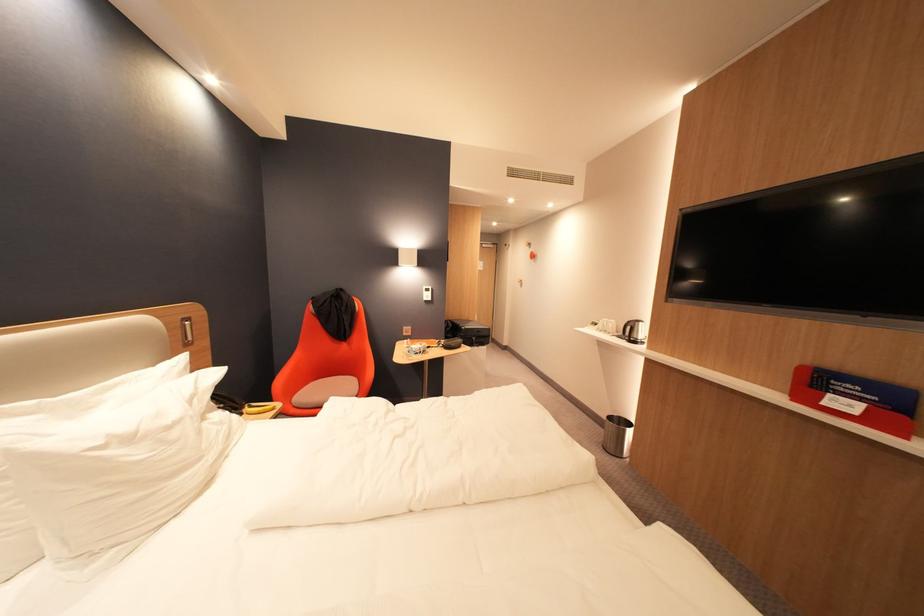
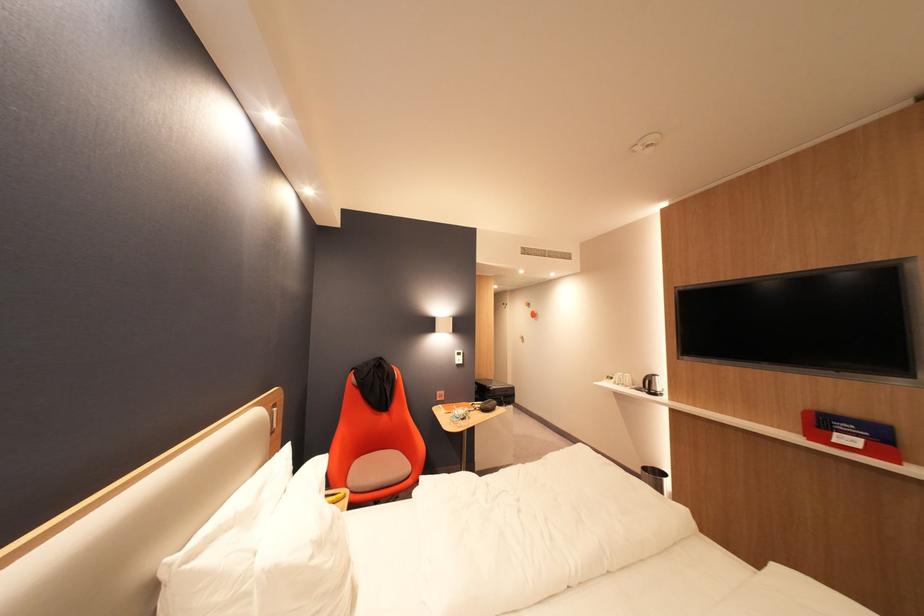
Where in the second image is the point corresponding to pixel 841 395 from the first image?

(846, 435)